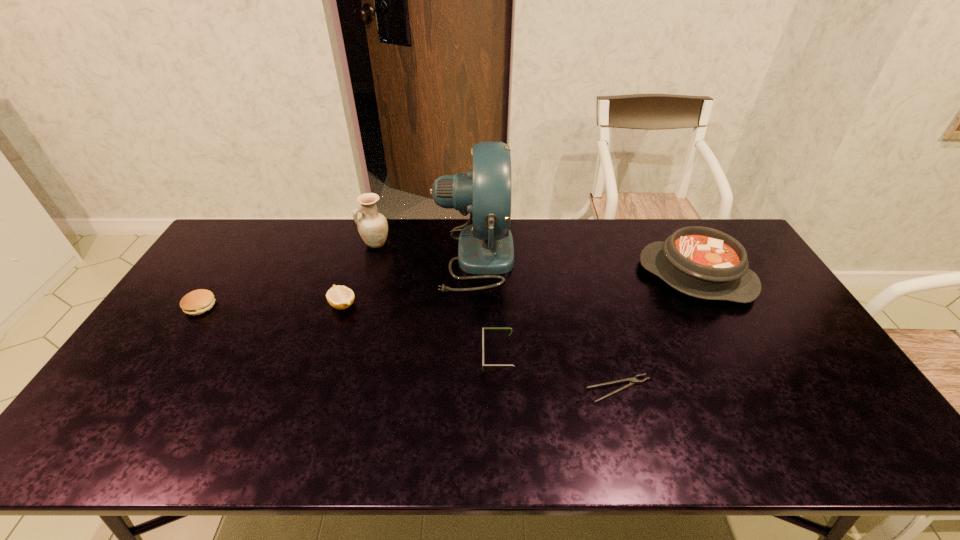
I want to click on object that stands as the third closest to the lemon, so click(196, 302).

Find the location of `vacant region that satisfies the following two spatial constraints: 1. on the back side of the tongs; 2. in front of the fan to blow air`. vacant region that satisfies the following two spatial constraints: 1. on the back side of the tongs; 2. in front of the fan to blow air is located at coordinates (582, 256).